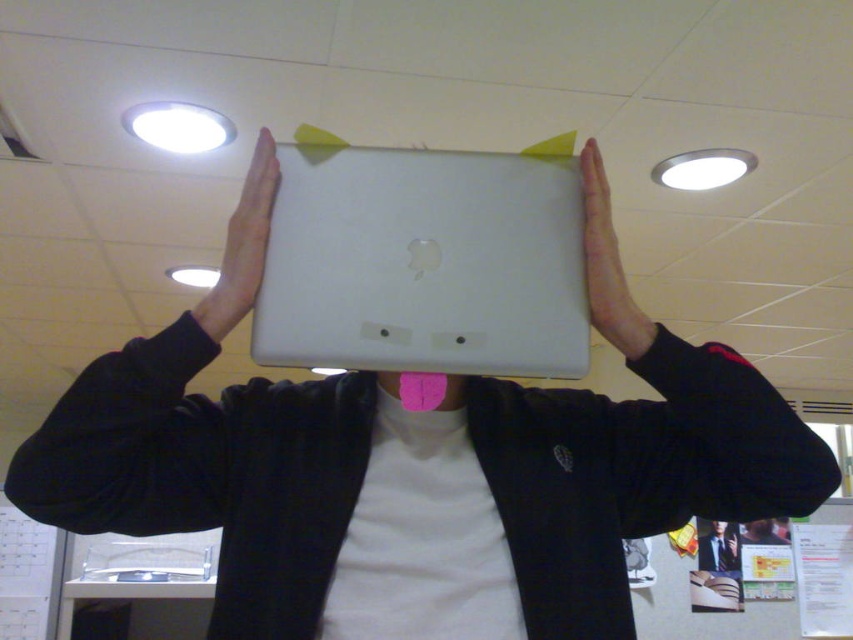
Consider the image. Which of these two, satin white laptop at center or pink matte tongue at center, stands taller?

Standing taller between the two is satin white laptop at center.

Is satin white laptop at center below pink matte tongue at center?

Yes.

Is point (512, 292) in front of point (589, 161)?

Yes, it is.

This screenshot has height=640, width=853. I want to click on satin white laptop at center, so click(x=424, y=262).

Can you confirm if satin white laptop at center is positioned below white matte laptop at center?

Correct, satin white laptop at center is located below white matte laptop at center.

Describe the element at coordinates (424, 262) in the screenshot. The height and width of the screenshot is (640, 853). I see `satin white laptop at center` at that location.

Where is `satin white laptop at center`? The height and width of the screenshot is (640, 853). satin white laptop at center is located at coordinates (424, 262).

Is pink matte tongue at center to the left of white matte laptop at center from the viewer's perspective?

No, pink matte tongue at center is not to the left of white matte laptop at center.

Does pink matte tongue at center have a lesser height compared to white matte laptop at center?

No, pink matte tongue at center is not shorter than white matte laptop at center.

Who is more distant from viewer, [604,205] or [254,225]?

The point [604,205] is behind.

You are a GUI agent. You are given a task and a screenshot of the screen. Output one action in this format:
    pyautogui.click(x=<x>, y=<y>)
    Task: Click on the pink matte tongue at center
    
    Given the screenshot: What is the action you would take?
    pyautogui.click(x=607, y=266)